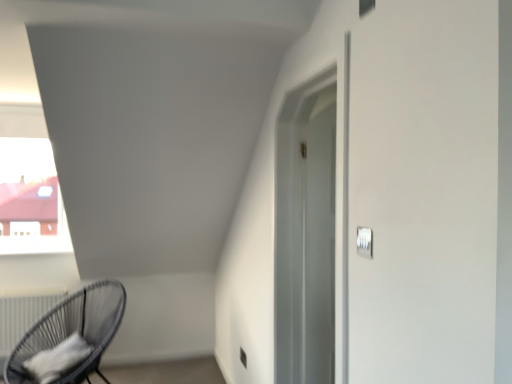
Question: Is black wicker chair at lower left taller than satin silver outlet at lower center?

Choices:
 (A) yes
 (B) no

Answer: (A)

Question: Does black wicker chair at lower left have a larger size compared to satin silver outlet at lower center?

Choices:
 (A) no
 (B) yes

Answer: (B)

Question: Can you confirm if black wicker chair at lower left is thinner than satin silver outlet at lower center?

Choices:
 (A) no
 (B) yes

Answer: (A)

Question: From the image's perspective, is black wicker chair at lower left beneath satin silver outlet at lower center?

Choices:
 (A) yes
 (B) no

Answer: (B)

Question: Is black wicker chair at lower left in front of satin silver outlet at lower center?

Choices:
 (A) no
 (B) yes

Answer: (B)

Question: Is white matte radiator at lower left situated inside white plastic light switch at upper right or outside?

Choices:
 (A) outside
 (B) inside

Answer: (A)

Question: From the image's perspective, is white matte radiator at lower left located above or below white plastic light switch at upper right?

Choices:
 (A) below
 (B) above

Answer: (A)

Question: From their relative heights in the image, would you say white matte radiator at lower left is taller or shorter than white plastic light switch at upper right?

Choices:
 (A) short
 (B) tall

Answer: (B)

Question: Would you say white matte radiator at lower left is to the left or to the right of white plastic light switch at upper right in the picture?

Choices:
 (A) left
 (B) right

Answer: (A)

Question: Is black wicker chair at lower left to the left or to the right of white matte radiator at lower left in the image?

Choices:
 (A) right
 (B) left

Answer: (A)

Question: Is black wicker chair at lower left inside or outside of white matte radiator at lower left?

Choices:
 (A) inside
 (B) outside

Answer: (B)

Question: Is point (29, 347) closer or farther from the camera than point (2, 324)?

Choices:
 (A) farther
 (B) closer

Answer: (B)

Question: Considering the positions of black wicker chair at lower left and white matte radiator at lower left in the image, is black wicker chair at lower left wider or thinner than white matte radiator at lower left?

Choices:
 (A) wide
 (B) thin

Answer: (A)

Question: From the image's perspective, relative to satin silver outlet at lower center, is black wicker chair at lower left above or below?

Choices:
 (A) above
 (B) below

Answer: (A)

Question: Looking at their shapes, would you say black wicker chair at lower left is wider or thinner than satin silver outlet at lower center?

Choices:
 (A) thin
 (B) wide

Answer: (B)